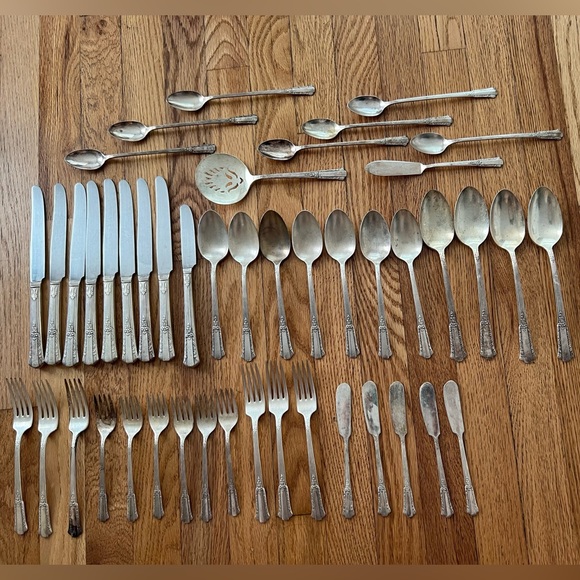
What are the coordinates of `knives` in the screenshot? It's located at (37, 245), (60, 248), (72, 252), (90, 257), (111, 258), (125, 259), (144, 259), (161, 259), (186, 258).